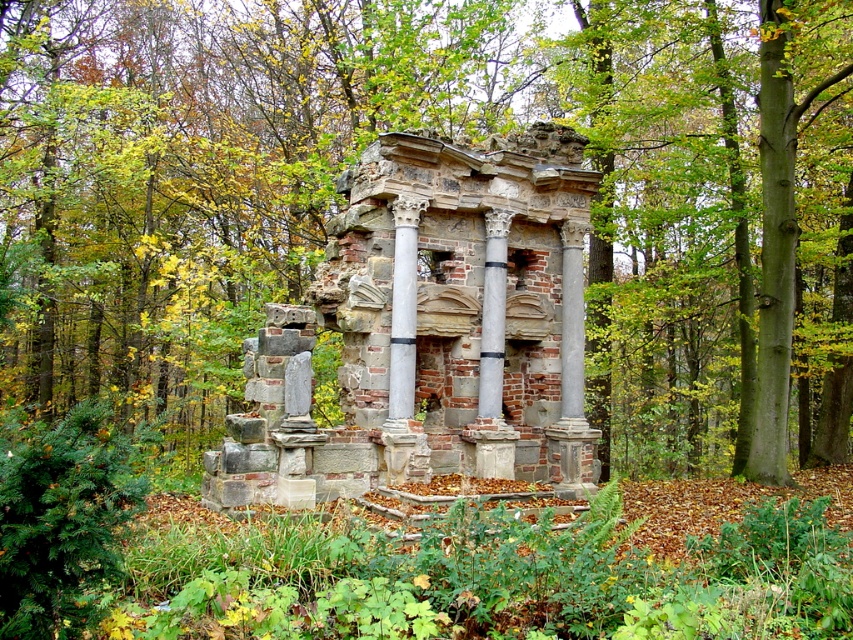
Question: Considering the relative positions of brick stone ruins at center and gray stone column at center in the image provided, where is brick stone ruins at center located with respect to gray stone column at center?

Choices:
 (A) above
 (B) below

Answer: (B)

Question: Does brick stone ruins at center appear over gray stone column at center?

Choices:
 (A) yes
 (B) no

Answer: (B)

Question: Which point appears farthest from the camera in this image?

Choices:
 (A) (436, 227)
 (B) (399, 368)
 (C) (503, 342)

Answer: (C)

Question: Is white marble column at center closer to the viewer compared to gray stone column at center?

Choices:
 (A) no
 (B) yes

Answer: (B)

Question: Based on their relative distances, which object is nearer to the brick stone ruins at center?

Choices:
 (A) gray stone column at center
 (B) white marble column at center

Answer: (A)

Question: Which point appears farthest from the camera in this image?

Choices:
 (A) (404, 285)
 (B) (358, 196)
 (C) (497, 337)

Answer: (C)